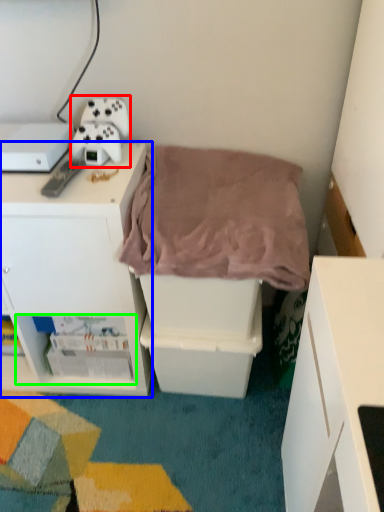
Question: Which object is the farthest from equipment (highlighted by a red box)? Choose among these: cabinetry (highlighted by a blue box) or shelf (highlighted by a green box).

Choices:
 (A) cabinetry
 (B) shelf

Answer: (B)